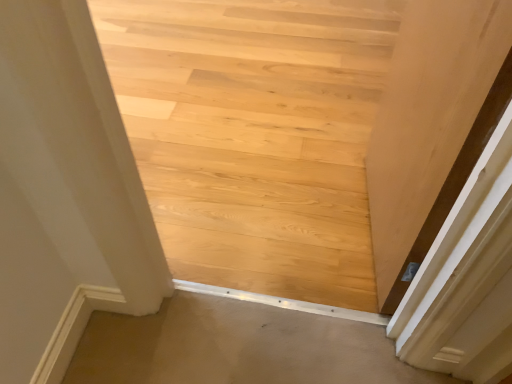
Question: Is natural wood floor at center thinner than beige carpet at lower center?

Choices:
 (A) no
 (B) yes

Answer: (A)

Question: Could you tell me if natural wood floor at center is turned towards beige carpet at lower center?

Choices:
 (A) no
 (B) yes

Answer: (A)

Question: Can we say natural wood floor at center lies outside beige carpet at lower center?

Choices:
 (A) no
 (B) yes

Answer: (B)

Question: Are natural wood floor at center and beige carpet at lower center located far from each other?

Choices:
 (A) no
 (B) yes

Answer: (A)

Question: From a real-world perspective, is natural wood floor at center on top of beige carpet at lower center?

Choices:
 (A) yes
 (B) no

Answer: (A)

Question: Is natural wood floor at center shorter than beige carpet at lower center?

Choices:
 (A) yes
 (B) no

Answer: (B)

Question: From a real-world perspective, is beige carpet at lower center physically below matte wood door at right?

Choices:
 (A) no
 (B) yes

Answer: (B)

Question: Would you say beige carpet at lower center is outside matte wood door at right?

Choices:
 (A) no
 (B) yes

Answer: (B)

Question: Considering the relative sizes of beige carpet at lower center and matte wood door at right in the image provided, is beige carpet at lower center wider than matte wood door at right?

Choices:
 (A) no
 (B) yes

Answer: (B)

Question: Is beige carpet at lower center further to the viewer compared to matte wood door at right?

Choices:
 (A) yes
 (B) no

Answer: (A)

Question: Considering the relative positions of beige carpet at lower center and matte wood door at right in the image provided, is beige carpet at lower center to the left of matte wood door at right from the viewer's perspective?

Choices:
 (A) no
 (B) yes

Answer: (B)

Question: From a real-world perspective, is beige carpet at lower center physically above matte wood door at right?

Choices:
 (A) no
 (B) yes

Answer: (A)

Question: Is matte wood door at right inside natural wood floor at center?

Choices:
 (A) yes
 (B) no

Answer: (B)